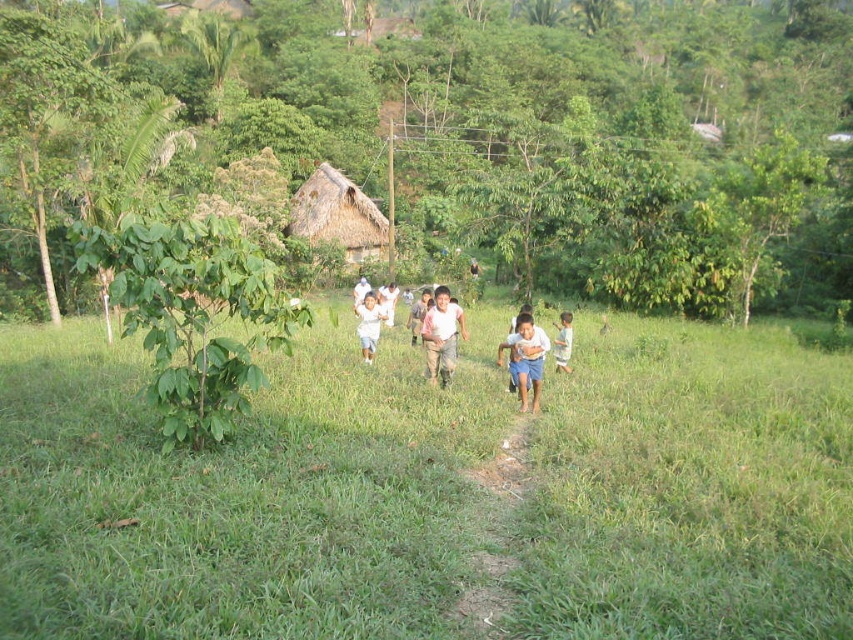
Does light blue cotton shirt at center lie in front of white cotton shirt at center?

Yes, it is in front of white cotton shirt at center.

Image resolution: width=853 pixels, height=640 pixels. What do you see at coordinates (527, 358) in the screenshot?
I see `light blue cotton shirt at center` at bounding box center [527, 358].

What are the coordinates of `light blue cotton shirt at center` in the screenshot? It's located at (527, 358).

Can you confirm if green grass at center is positioned below light blue shorts at center?

Correct, green grass at center is located below light blue shorts at center.

Between point (724, 509) and point (570, 369), which one is positioned behind?

Point (570, 369)

The height and width of the screenshot is (640, 853). What do you see at coordinates (434, 492) in the screenshot?
I see `green grass at center` at bounding box center [434, 492].

This screenshot has height=640, width=853. I want to click on green grass at center, so click(434, 492).

Who is more forward, (511, 630) or (480, 634)?

Point (480, 634) is in front.

Can you confirm if green grass at center is positioned above dirt path at center?

Correct, green grass at center is located above dirt path at center.

Is point (173, 529) farther from viewer compared to point (527, 416)?

That is False.

Locate an element on the screen. This screenshot has height=640, width=853. green grass at center is located at coordinates (434, 492).